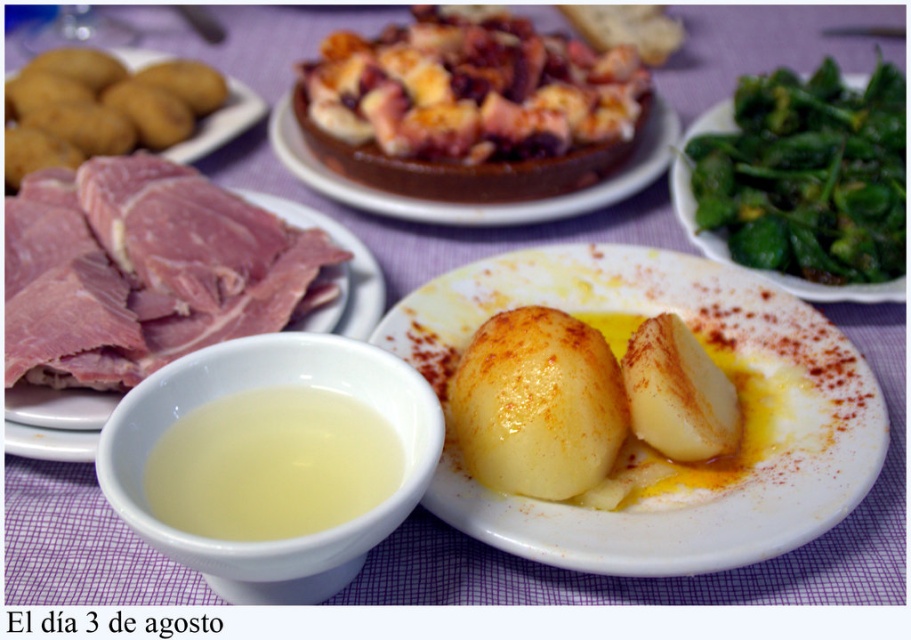
Question: Observing the image, what is the correct spatial positioning of smooth yellow potatoes at center in reference to golden-brown flaky pastry at center?

Choices:
 (A) left
 (B) right

Answer: (B)

Question: Estimate the real-world distances between objects in this image. Which object is farther from the smooth yellow potatoes at center?

Choices:
 (A) yellow matte potatoes at left
 (B) yellow matte potato at center
 (C) glossy yellow potato at center

Answer: (A)

Question: Is translucent white bowl at lower left smaller than chocolate cake at center?

Choices:
 (A) yes
 (B) no

Answer: (A)

Question: Which point is closer to the camera?

Choices:
 (A) (137, 388)
 (B) (172, 113)
 (C) (739, 310)
 (D) (571, 209)

Answer: (A)

Question: Based on their relative distances, which object is nearer to the pink raw meat at left?

Choices:
 (A) translucent white bowl at lower left
 (B) chocolate cake at center

Answer: (B)

Question: Can you confirm if smooth yellow potatoes at center is bigger than pink raw meat at left?

Choices:
 (A) yes
 (B) no

Answer: (A)